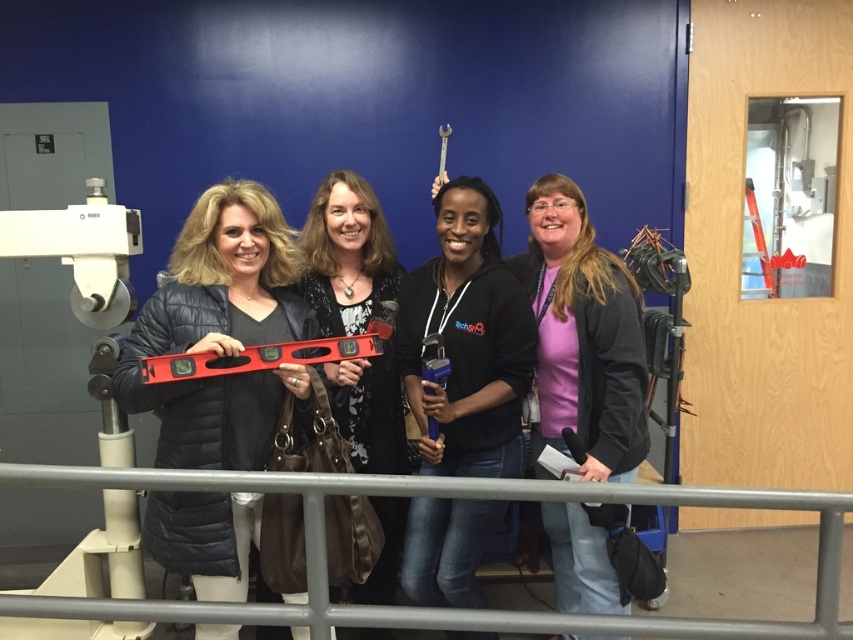
Question: Which point is closer to the camera?

Choices:
 (A) (329, 211)
 (B) (426, 392)
 (C) (486, 410)

Answer: (B)

Question: Does matte black jacket at center appear under blue plastic level at center?

Choices:
 (A) yes
 (B) no

Answer: (A)

Question: Which object is farther from the camera taking this photo?

Choices:
 (A) blue plastic level at center
 (B) matte black level at center
 (C) black matte sweatshirt at center
 (D) gray metal rail at lower center

Answer: (C)

Question: Which object appears closest to the camera in this image?

Choices:
 (A) black matte sweatshirt at center
 (B) blue plastic level at center
 (C) red plastic level at center
 (D) gray metal rail at lower center

Answer: (D)

Question: From the image, what is the correct spatial relationship of black matte sweatshirt at center in relation to blue plastic level at center?

Choices:
 (A) left
 (B) right

Answer: (B)

Question: In this image, where is matte black level at center located relative to blue plastic level at center?

Choices:
 (A) above
 (B) below

Answer: (B)